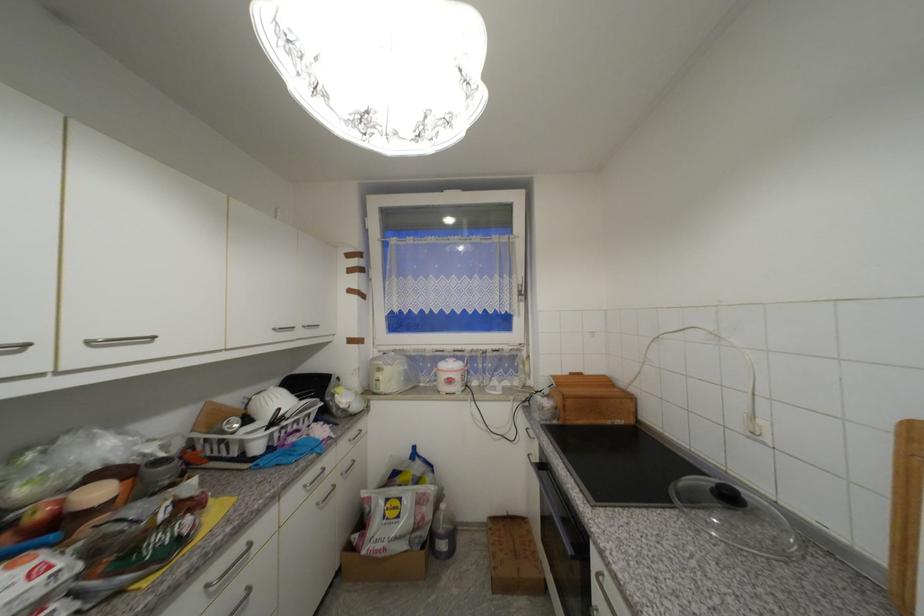
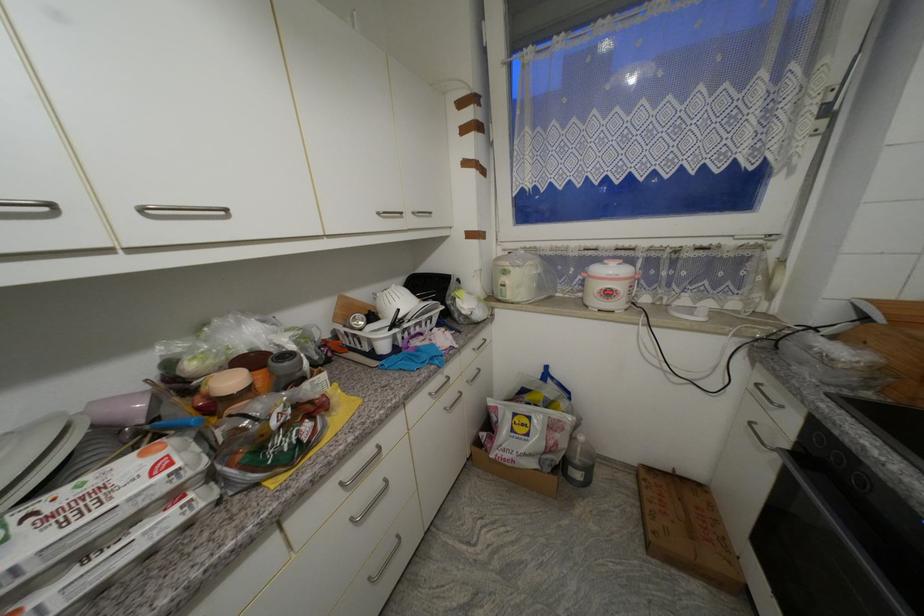
Find the pixel in the second image that matches (x=281, y=331) in the first image.

(383, 215)